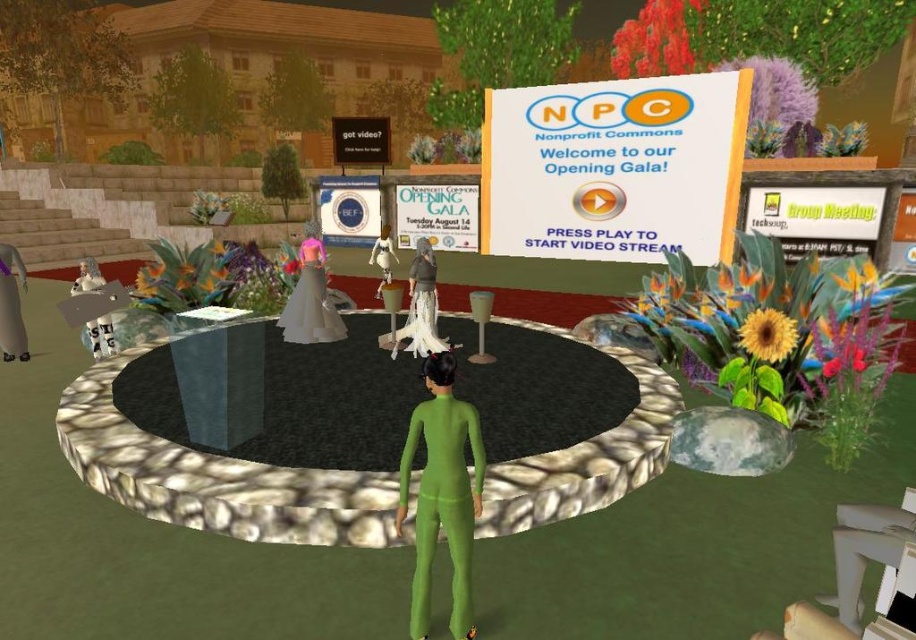
From the picture: You are an avatar in the virtual environment and want to greet the person wearing the white fabric dress at center. Since you are standing near the white matte dress at center, which direction should you move to reach them?

The white fabric dress at center is positioned on the right side of the white matte dress at center, so you should move to your right to reach them.

You are an avatar in a virtual environment and need to reach the white matte statue at lower left from the green rubber person at center. What is the approximate distance you need to travel?

The distance between the green rubber person at center and the white matte statue at lower left is 75.92 centimeters.